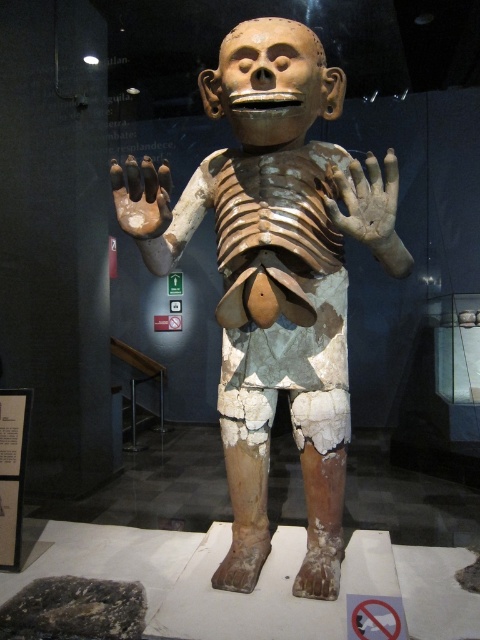
You are standing in front of the sculpture and want to take a photo of the point at coordinates point (391,236). Your camera has a maximum focus range of 1.5 meters. Will the camera be able to focus on the point?

The distance between point (391,236) and the camera is 1.51 meters, which is slightly beyond the camera maximum focus range of 1.5 meters. Therefore, the camera will not be able to focus on the point.

You are standing in front of the sculpture and want to touch the point at coordinates point (x=231, y=209). Can you reach it without moving your body? Assume your arm can extend 3 feet.

The point (x=231, y=209) is 5.50 feet away from the camera. Since your arm can only extend 3 feet, you cannot reach it without moving your body.

You are an art conservator assessing the sculpture. You notice two hands at the center of the sculpture, one labeled as matte clay hand at center and the other as brown matte hand at center. Which hand is taller?

The matte clay hand at center is taller than the brown matte hand at center according to the description.